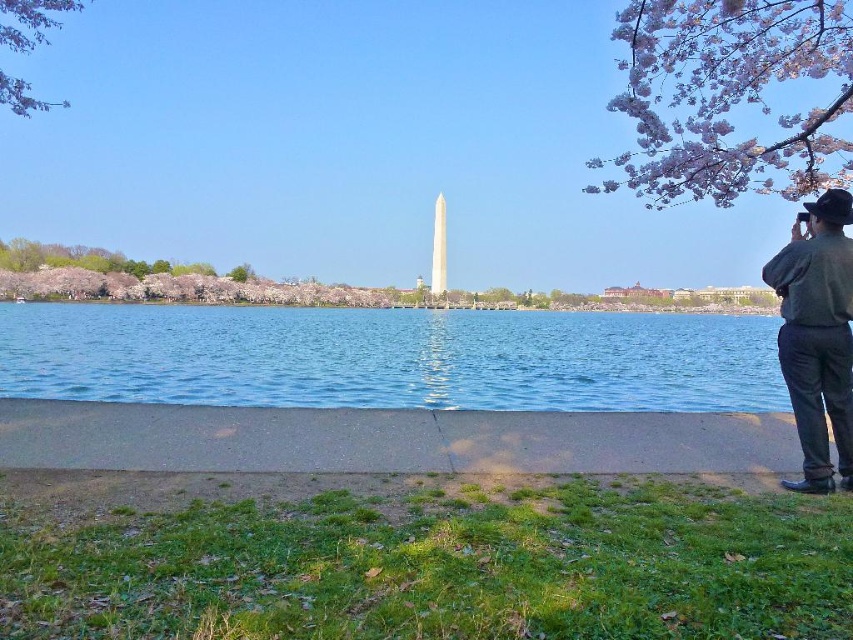
You are standing on the paved walkway near the Tidal Basin and see the green leafy tree at upper left and the green leafy tree at center. Which tree is positioned more to the east?

The green leafy tree at upper left is positioned more to the east because it is to the left of the green leafy tree at center, and in the image, left corresponds to the eastern direction.

You are standing on the paved walkway at the Tidal Basin and want to take a photo of the Washington Monument. There are two points marked in the image, point A at coordinates point (0, 83) and point B at coordinates point (245, 276). Which point should you choose to ensure you are closer to the monument for your photo?

Point A at coordinates point (0, 83) is closer to the viewer than point B at coordinates point (245, 276), so you should choose point A to be closer to the Washington Monument for your photo.

You are standing on the paved walkway and want to take a photo of the peachy blossom branch at upper right without the clear blue water at center appearing in the frame. Is this possible based on their positions?

The clear blue water at center is in front of the peachy blossom branch at upper right, so you cannot avoid capturing the clear blue water at center in the photo if you want to include the peachy blossom branch at upper right.